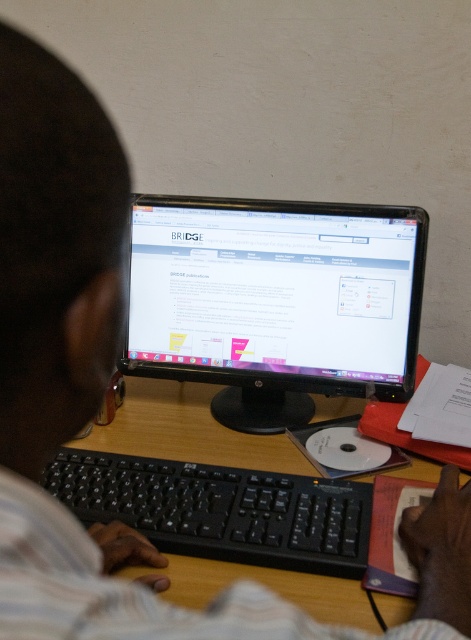
Can you confirm if black glossy monitor at center is thinner than wooden table at center?

Yes.

Is point (293, 346) positioned before point (102, 465)?

No, it is behind (102, 465).

Find the location of a particular element. black glossy monitor at center is located at coordinates (275, 301).

The width and height of the screenshot is (471, 640). Identify the location of black glossy monitor at center. (275, 301).

Is black glossy monitor at center above black plastic keyboard at lower center?

→ Yes, black glossy monitor at center is above black plastic keyboard at lower center.

Between point (316, 346) and point (51, 493), which one is positioned behind?

The point (316, 346) is more distant.

Image resolution: width=471 pixels, height=640 pixels. Identify the location of black glossy monitor at center. (275, 301).

Is wooden table at center shorter than black plastic keyboard at lower center?

No, wooden table at center is not shorter than black plastic keyboard at lower center.

Looking at this image, is wooden table at center wider than black plastic keyboard at lower center?

Yes, wooden table at center is wider than black plastic keyboard at lower center.

Which is behind, point (435, 465) or point (321, 512)?

The point (435, 465) is more distant.

Image resolution: width=471 pixels, height=640 pixels. Identify the location of wooden table at center. (227, 502).